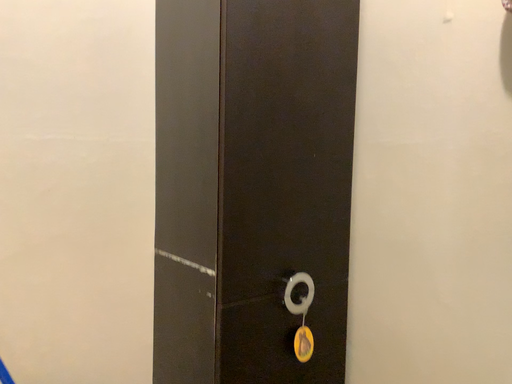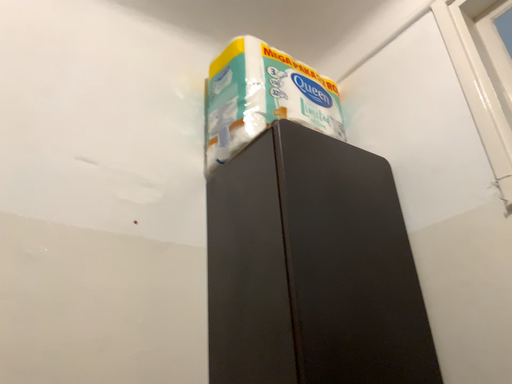
Question: Which way did the camera rotate in the video?

Choices:
 (A) rotated downward
 (B) rotated upward

Answer: (B)